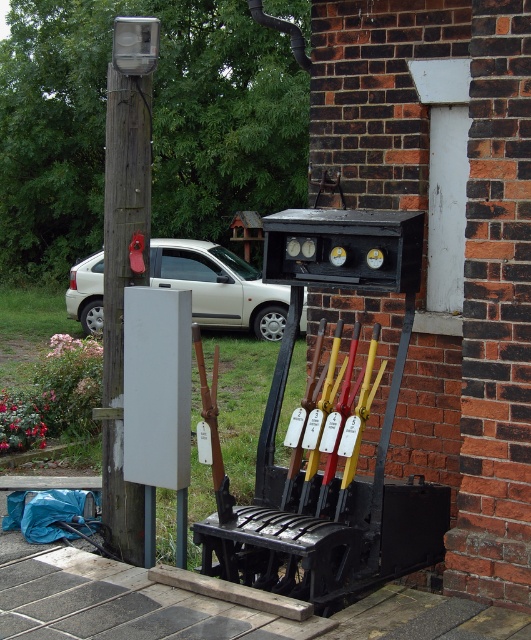
Question: Is wooden pole at left thinner than white matte car at left?

Choices:
 (A) no
 (B) yes

Answer: (B)

Question: Does wooden pole at left lie behind white matte car at left?

Choices:
 (A) yes
 (B) no

Answer: (B)

Question: Does wooden pole at left have a larger size compared to white matte car at left?

Choices:
 (A) yes
 (B) no

Answer: (B)

Question: Which point is farther to the camera?

Choices:
 (A) (243, 291)
 (B) (125, 232)

Answer: (A)

Question: Which of the following is the farthest from the observer?

Choices:
 (A) white matte car at left
 (B) wooden pole at left

Answer: (A)